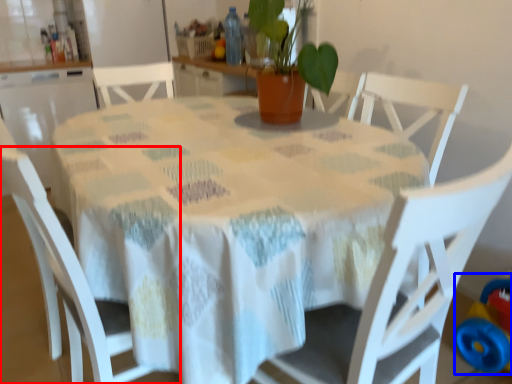
Question: Which object is further to the camera taking this photo, chair (highlighted by a red box) or toy (highlighted by a blue box)?

Choices:
 (A) chair
 (B) toy

Answer: (B)